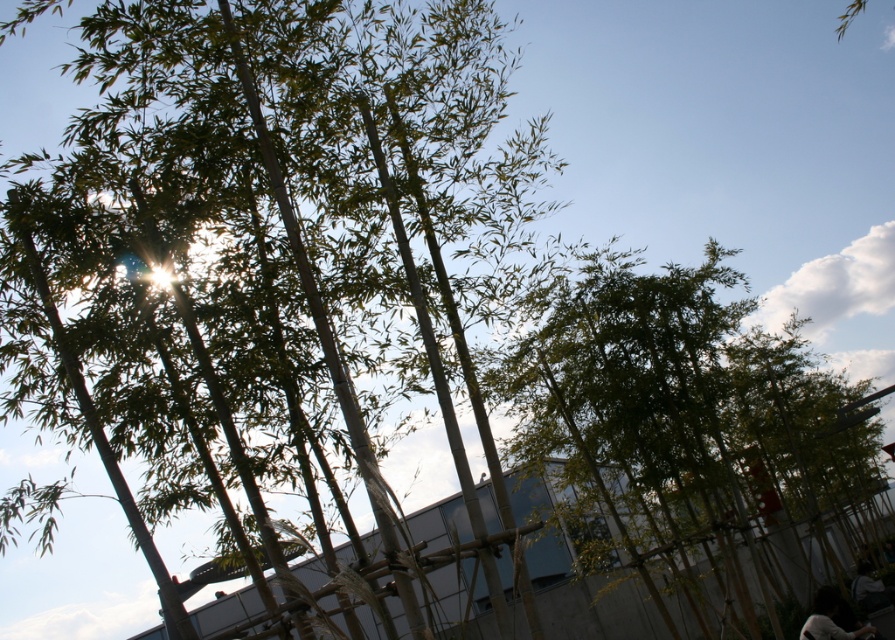
Does green leafy tree at center have a larger size compared to dark gray fabric bag at lower right?

Indeed, green leafy tree at center has a larger size compared to dark gray fabric bag at lower right.

Does point (644, 396) come in front of point (858, 602)?

That is True.

This screenshot has width=895, height=640. What do you see at coordinates (689, 422) in the screenshot?
I see `green leafy tree at center` at bounding box center [689, 422].

The width and height of the screenshot is (895, 640). Identify the location of green leafy tree at center. (689, 422).

Who is higher up, dark hair at lower right or dark gray fabric bag at lower right?

dark hair at lower right

What do you see at coordinates (831, 620) in the screenshot? Image resolution: width=895 pixels, height=640 pixels. I see `dark hair at lower right` at bounding box center [831, 620].

Is point (833, 630) positioned in front of point (864, 605)?

Yes, it is in front of point (864, 605).

Identify the location of dark hair at lower right. (831, 620).

Is green leafy tree at center smaller than dark hair at lower right?

Actually, green leafy tree at center might be larger than dark hair at lower right.

Who is more distant from viewer, (581,563) or (800,628)?

The point (581,563) is more distant.

Does point (535, 428) come farther from viewer compared to point (827, 612)?

Yes, it is.

Where is `green leafy tree at center`? This screenshot has height=640, width=895. green leafy tree at center is located at coordinates (689, 422).